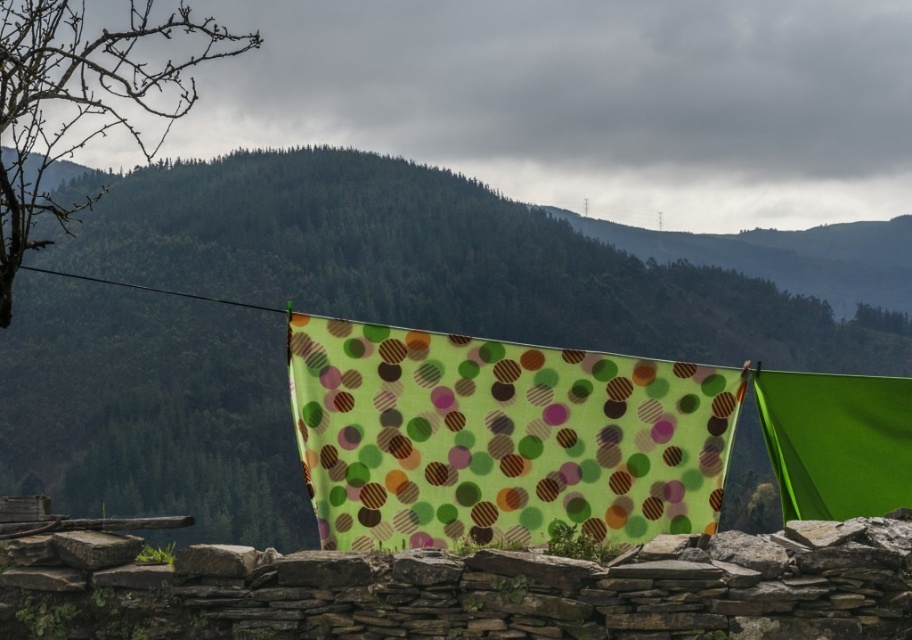
Describe the element at coordinates (441, 262) in the screenshot. I see `green fabric at center` at that location.

Is point (437, 275) farther from viewer compared to point (135, 284)?

No, (437, 275) is in front of (135, 284).

Who is more forward, [356,288] or [99,280]?

Point [356,288] is in front.

Locate an element on the screen. The image size is (912, 640). green fabric at center is located at coordinates (441, 262).

Which is in front, point (144, 104) or point (172, 292)?

Point (172, 292) is more forward.

Identify the location of bare branches at left. This screenshot has height=640, width=912. (81, 100).

Which is more to the left, green polka dot fabric at center or bare branches at left?

bare branches at left

Consider the image. Who is taller, green polka dot fabric at center or bare branches at left?

bare branches at left

Image resolution: width=912 pixels, height=640 pixels. I want to click on green polka dot fabric at center, so click(x=566, y=438).

This screenshot has width=912, height=640. Identify the location of green polka dot fabric at center. (566, 438).